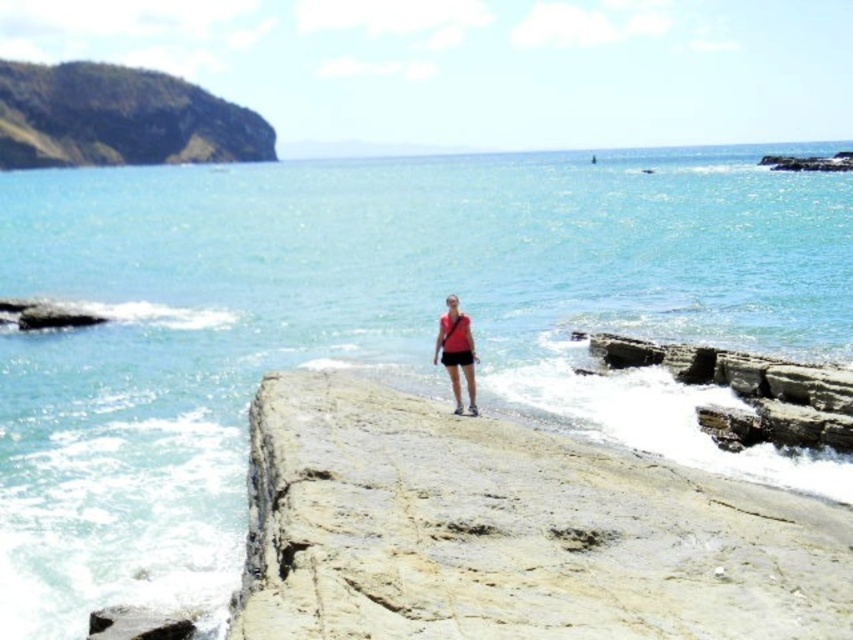
Is green mossy rock at upper left below matte red shirt at center?

No.

Image resolution: width=853 pixels, height=640 pixels. I want to click on green mossy rock at upper left, so click(x=119, y=118).

This screenshot has height=640, width=853. Describe the element at coordinates (119, 118) in the screenshot. I see `green mossy rock at upper left` at that location.

The image size is (853, 640). Find the location of `green mossy rock at upper left`. green mossy rock at upper left is located at coordinates (119, 118).

Between smooth beige rock at center and green mossy rock at upper left, which one is positioned lower?

Positioned lower is smooth beige rock at center.

Can you confirm if smooth beige rock at center is smaller than green mossy rock at upper left?

Correct, smooth beige rock at center occupies less space than green mossy rock at upper left.

Is point (341, 486) positioned behind point (202, 92)?

No.

Identify the location of smooth beige rock at center. This screenshot has height=640, width=853. tap(511, 531).

Does green mossy rock at upper left have a larger size compared to rough stone rock at lower right?

Indeed, green mossy rock at upper left has a larger size compared to rough stone rock at lower right.

Is point (0, 161) more distant than point (850, 390)?

Yes, point (0, 161) is farther from viewer.

What are the coordinates of `green mossy rock at upper left` in the screenshot? It's located at (119, 118).